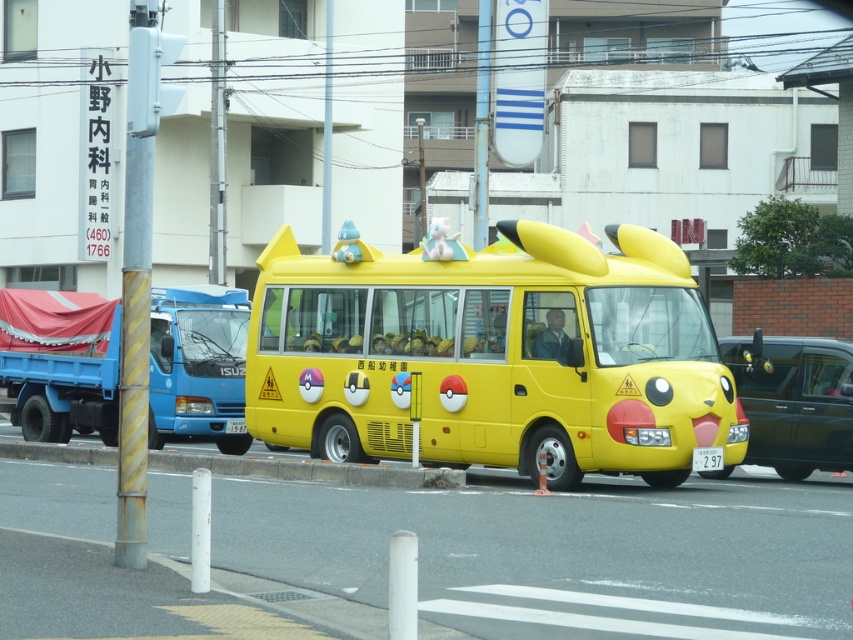
Question: From the image, what is the correct spatial relationship of blue metallic truck at left in relation to shiny black car at right?

Choices:
 (A) right
 (B) left

Answer: (B)

Question: Which point is closer to the camera?

Choices:
 (A) (195, 394)
 (B) (772, 416)

Answer: (B)

Question: Does shiny black car at right appear over white plastic license plate at center?

Choices:
 (A) no
 (B) yes

Answer: (B)

Question: Which object appears closest to the camera in this image?

Choices:
 (A) blue metallic truck at left
 (B) white plastic license plate at center
 (C) yellow matte school bus at center
 (D) shiny black car at right

Answer: (B)

Question: Which point is closer to the camera?

Choices:
 (A) (848, 346)
 (B) (699, 333)

Answer: (B)

Question: Is yellow matte school bus at center positioned behind blue metallic truck at left?

Choices:
 (A) yes
 (B) no

Answer: (B)